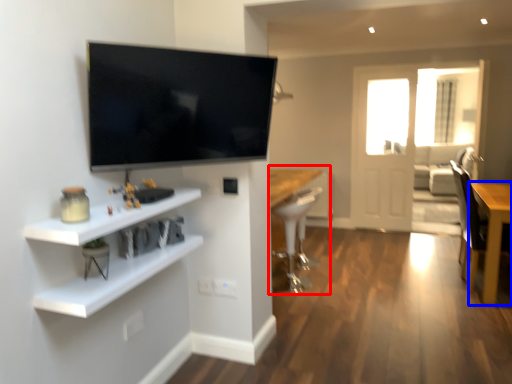
Question: Which point is further to the camera, computer desk (highlighted by a red box) or table (highlighted by a blue box)?

Choices:
 (A) computer desk
 (B) table

Answer: (A)